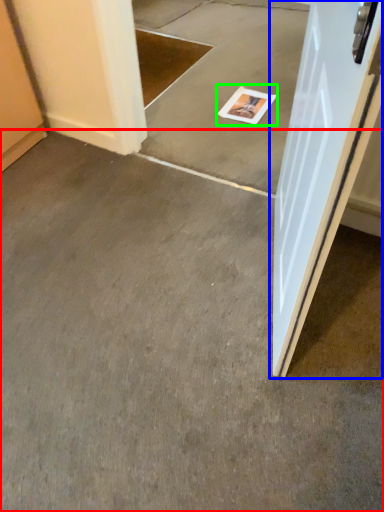
Question: Estimate the real-world distances between objects in this image. Which object is closer to concrete (highlighted by a red box), door (highlighted by a blue box) or magazine (highlighted by a green box)?

Choices:
 (A) door
 (B) magazine

Answer: (A)